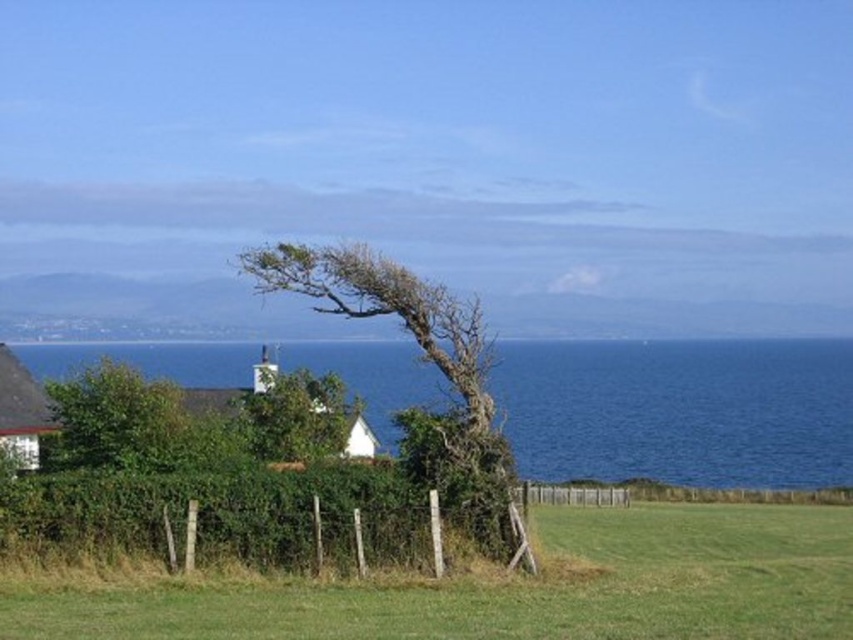
Question: Which object is positioned farthest from the green leafy tree at center?

Choices:
 (A) green grass at lower center
 (B) green leafy tree at lower left
 (C) bare wood tree at center
 (D) blue water at center

Answer: (D)

Question: Is green grass at lower center behind green leafy tree at lower left?

Choices:
 (A) yes
 (B) no

Answer: (B)

Question: Can you confirm if blue water at center is thinner than green leafy tree at lower left?

Choices:
 (A) yes
 (B) no

Answer: (B)

Question: Is bare wood tree at center below green leafy tree at lower left?

Choices:
 (A) no
 (B) yes

Answer: (A)

Question: Which point is closer to the camera taking this photo?

Choices:
 (A) (86, 385)
 (B) (320, 376)
 (C) (558, 604)
 (D) (677, 362)

Answer: (C)

Question: Among these points, which one is farthest from the camera?

Choices:
 (A) (74, 444)
 (B) (480, 452)
 (C) (100, 620)
 (D) (671, 394)

Answer: (D)